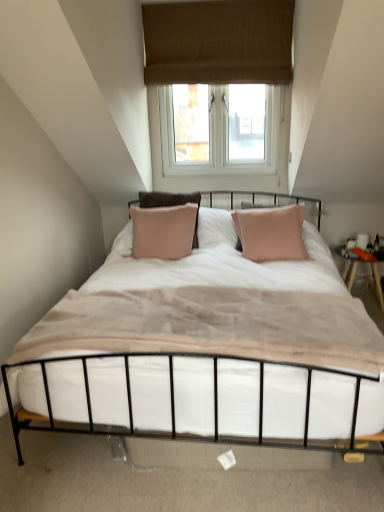
Question: Considering the positions of white soft mattress at center and metallic white bed at center in the image, is white soft mattress at center wider or thinner than metallic white bed at center?

Choices:
 (A) thin
 (B) wide

Answer: (A)

Question: Considering the relative positions of white soft mattress at center and metallic white bed at center in the image provided, is white soft mattress at center to the left or to the right of metallic white bed at center?

Choices:
 (A) left
 (B) right

Answer: (A)

Question: Which object is the farthest from the metallic white bed at center?

Choices:
 (A) wooden nightstand at right
 (B) brown fabric window at upper center
 (C) white soft mattress at center

Answer: (B)

Question: Which object is the closest to the white soft mattress at center?

Choices:
 (A) metallic white bed at center
 (B) wooden nightstand at right
 (C) brown fabric window at upper center

Answer: (A)